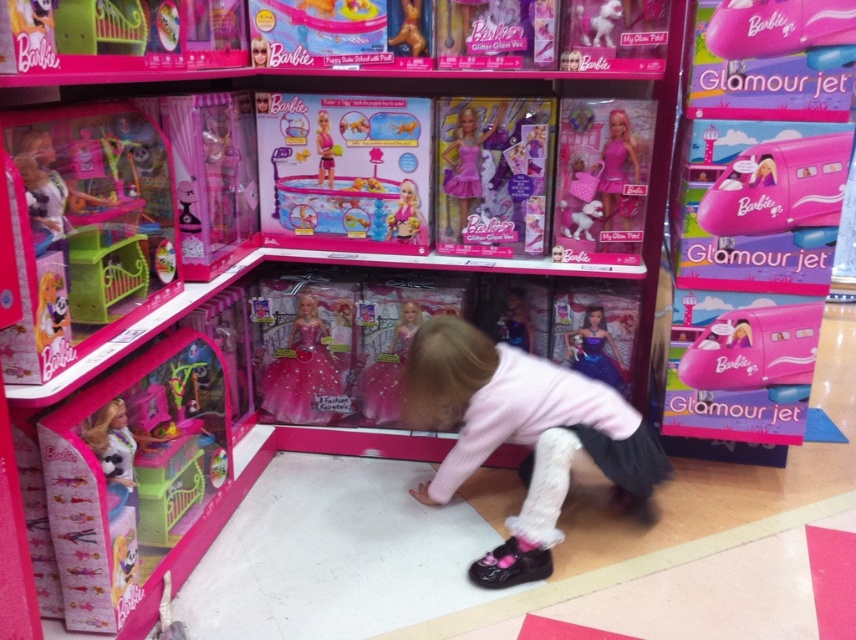
Question: Estimate the real-world distances between objects in this image. Which object is farther from the matte pink doll at center?

Choices:
 (A) pink glossy glamour jet at upper right
 (B) pink glossy glamour jet at center

Answer: (A)

Question: Which of the following is the farthest from the observer?

Choices:
 (A) pink fabric skirt at center
 (B) pink plastic doll at center
 (C) pink satin dress at center

Answer: (B)

Question: Which point appears closest to the camera in this image?

Choices:
 (A) (412, 218)
 (B) (413, 1)
 (C) (726, 381)

Answer: (B)

Question: Observing the image, what is the correct spatial positioning of pink satin dress at center in reference to pink matte dress at upper center?

Choices:
 (A) above
 (B) below

Answer: (A)

Question: Does pink glossy glamour jet at center appear on the right side of matte pink doll at center?

Choices:
 (A) no
 (B) yes

Answer: (B)

Question: Can you confirm if pink glossy glamour jet at upper right is positioned to the right of pink glittery dress at center?

Choices:
 (A) yes
 (B) no

Answer: (A)